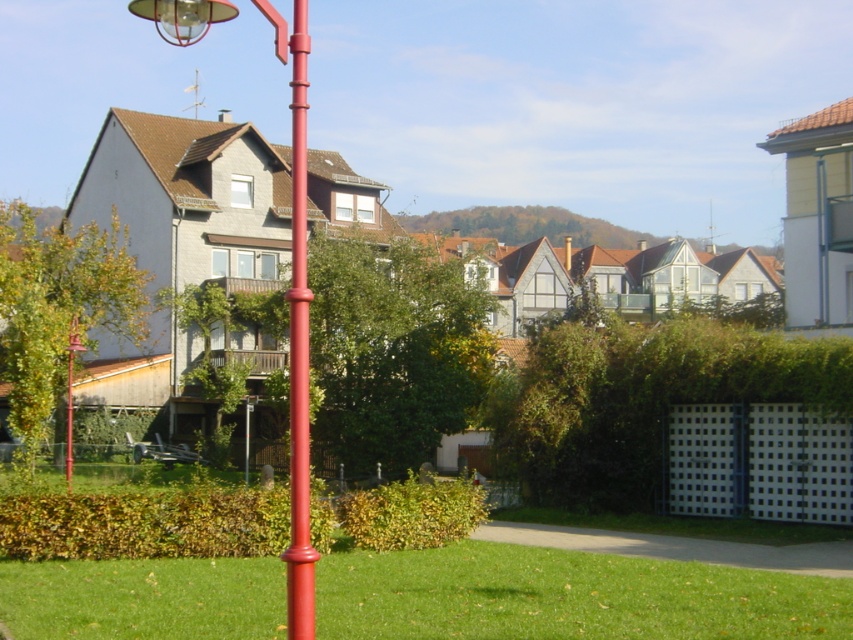
Question: Which of the following is the farthest from the observer?

Choices:
 (A) (303, 244)
 (B) (308, 528)

Answer: (A)

Question: Among these points, which one is farthest from the camera?

Choices:
 (A) (305, 449)
 (B) (293, 161)

Answer: (B)

Question: Can you confirm if metallic red pole at center is positioned to the right of smooth glossy red pole at center?

Choices:
 (A) yes
 (B) no

Answer: (B)

Question: Does metallic red pole at center have a lesser width compared to smooth glossy red pole at center?

Choices:
 (A) no
 (B) yes

Answer: (A)

Question: Can you confirm if metallic red pole at center is thinner than smooth glossy red pole at center?

Choices:
 (A) no
 (B) yes

Answer: (A)

Question: Among these objects, which one is nearest to the camera?

Choices:
 (A) smooth glossy red pole at center
 (B) metallic red pole at center

Answer: (A)